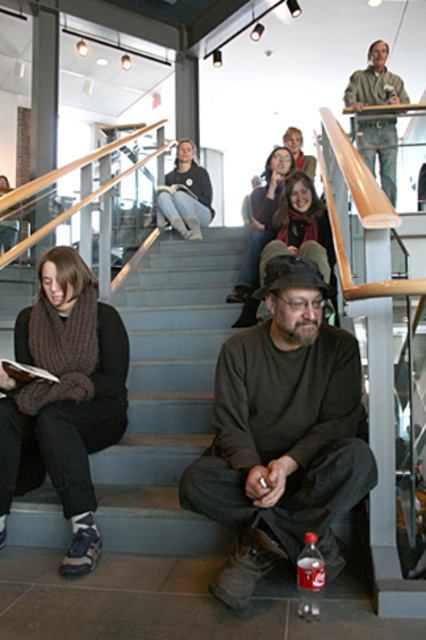
Is dark brown sweater at center behind light brown leather jacket at upper center?

No, dark brown sweater at center is in front of light brown leather jacket at upper center.

Is dark brown sweater at center taller than light brown leather jacket at upper center?

Incorrect, dark brown sweater at center's height is not larger of light brown leather jacket at upper center's.

This screenshot has width=426, height=640. I want to click on dark brown sweater at center, so click(x=282, y=433).

Can you confirm if blue painted stairs at center is smaller than knitted scarf at left?

No, blue painted stairs at center is not smaller than knitted scarf at left.

Where is `blue painted stairs at center`? blue painted stairs at center is located at coordinates (167, 394).

Can you confirm if blue painted stairs at center is shorter than knitted scarf at center?

Correct, blue painted stairs at center is not as tall as knitted scarf at center.

Is point (123, 467) behind point (287, 170)?

No, it is not.

Identify the location of blue painted stairs at center. (167, 394).